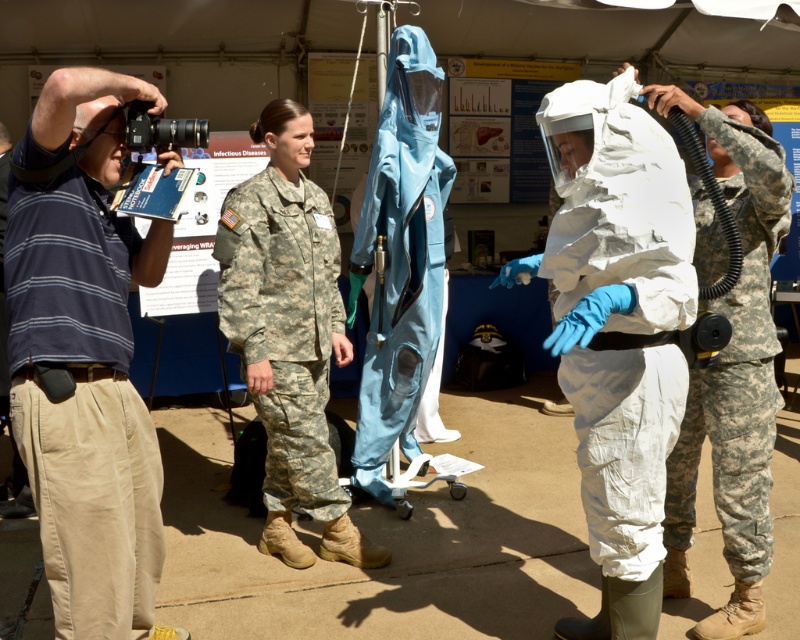
Consider the image. Is camouflage fabric uniform at center to the right of striped cotton shirt at left from the viewer's perspective?

Indeed, camouflage fabric uniform at center is positioned on the right side of striped cotton shirt at left.

Which is behind, point (280, 179) or point (30, 509)?

Positioned behind is point (30, 509).

What are the coordinates of `camouflage fabric uniform at center` in the screenshot? It's located at (285, 326).

Consider the image. Can you confirm if striped cotton polo shirt at left is shorter than striped cotton shirt at left?

Correct, striped cotton polo shirt at left is not as tall as striped cotton shirt at left.

Who is more distant from viewer, (24, 257) or (2, 384)?

The point (2, 384) is more distant.

Is point (104, 344) farther from viewer compared to point (8, 144)?

No, it is in front of (8, 144).

This screenshot has height=640, width=800. In order to click on striped cotton polo shirt at left in this screenshot , I will do `click(82, 404)`.

Is point (636, 508) positioned before point (5, 132)?

That is True.

From the picture: Is white matte hazmat suit at center shorter than striped cotton shirt at left?

Indeed, white matte hazmat suit at center has a lesser height compared to striped cotton shirt at left.

Which is in front, point (644, 573) or point (4, 216)?

Point (644, 573)

Identify the location of white matte hazmat suit at center. Image resolution: width=800 pixels, height=640 pixels. (621, 310).